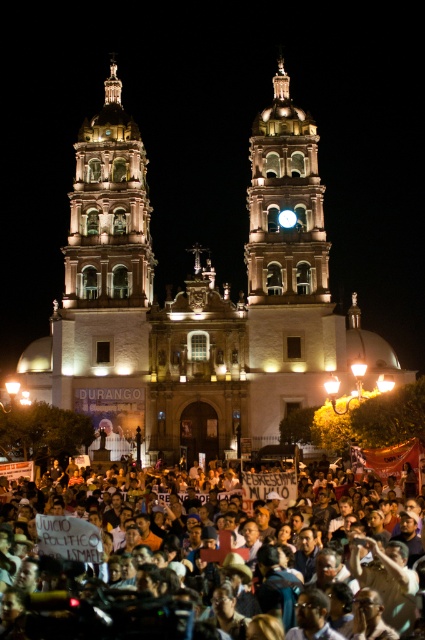
You are a photographer standing at the edge of the dark skin crowd at lower center. You want to take a photo of the illuminated stone church at center. Which direction should you move to get the church in your frame?

The illuminated stone church at center is to the right of dark skin crowd at lower center, so you should move to the right to position the church within your frame.

You are standing in the crowd in front of the illuminated stone church at center. You want to take a photo of the church with your phone. Considering the distance, will you need to zoom in to capture the entire structure?

The illuminated stone church at center is 89.18 meters away from the viewer. Since most smartphones have a wide enough angle to capture a large structure like a church at that distance without zooming, you should be able to capture the entire structure without zooming in.